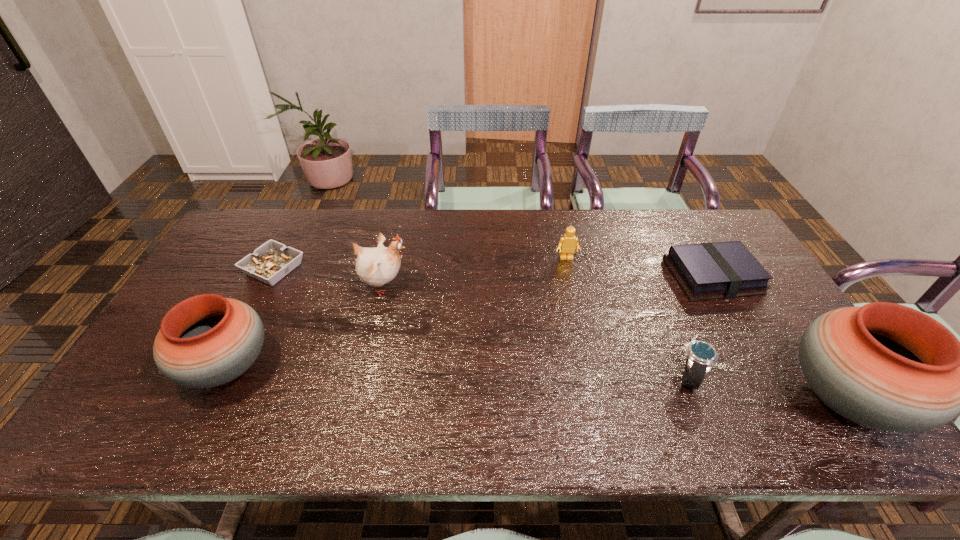
Identify the location of the shorter pottery. (207, 340).

Identify the location of the tallest object. Image resolution: width=960 pixels, height=540 pixels. [887, 366].

Locate an element on the screen. The height and width of the screenshot is (540, 960). the taller pottery is located at coordinates (887, 366).

Where is `the third object from left to right`? the third object from left to right is located at coordinates (377, 266).

Locate an element on the screen. This screenshot has height=540, width=960. ashtray is located at coordinates point(269,263).

Identify the location of the second shortest object. The image size is (960, 540). (720, 270).

You are a GUI agent. You are given a task and a screenshot of the screen. Output one action in this format:
    pyautogui.click(x=<x>, y=<y>)
    Task: Click on the fourth object from right to left
    
    Given the screenshot: What is the action you would take?
    pyautogui.click(x=568, y=243)

Identify the location of the fourth tallest object. The image size is (960, 540). (568, 243).

The height and width of the screenshot is (540, 960). In order to click on the third object from right to left in this screenshot , I will do `click(701, 356)`.

Image resolution: width=960 pixels, height=540 pixels. Find the location of `watch`. watch is located at coordinates (x=701, y=356).